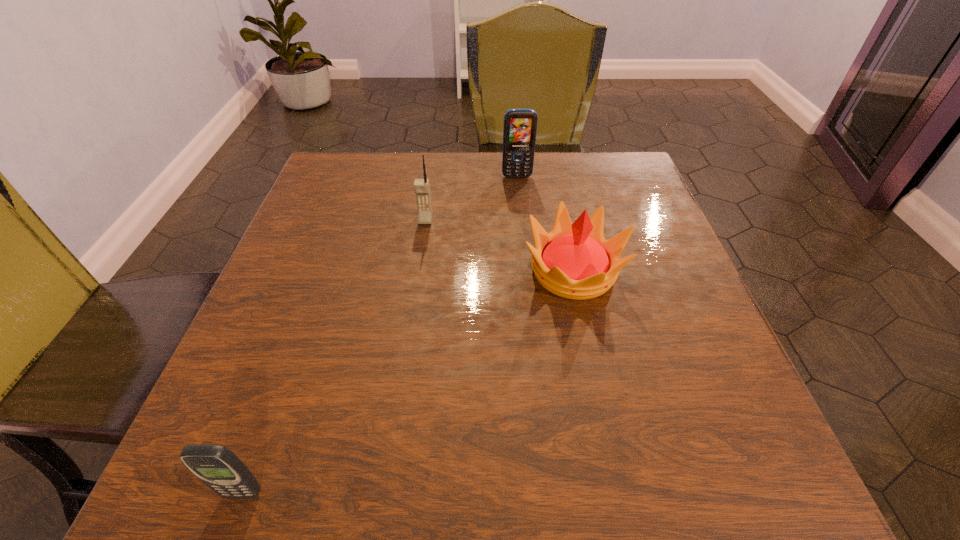
The width and height of the screenshot is (960, 540). I want to click on object present at the far edge, so click(520, 125).

You are a GUI agent. You are given a task and a screenshot of the screen. Output one action in this format:
    pyautogui.click(x=<x>, y=<y>)
    Task: Click on the object that is positioned at the near edge
    The height and width of the screenshot is (540, 960).
    Given the screenshot: What is the action you would take?
    pyautogui.click(x=220, y=469)

Find the location of `object present at the left edge`. object present at the left edge is located at coordinates (220, 469).

Identify the location of object that is at the right edge. Image resolution: width=960 pixels, height=540 pixels. (574, 261).

This screenshot has width=960, height=540. What are the coordinates of `object positioned at the near left corner` in the screenshot? It's located at (220, 469).

The width and height of the screenshot is (960, 540). In the image, there is a desktop. What are the coordinates of `vacant space at the far edge` in the screenshot? It's located at (441, 183).

This screenshot has width=960, height=540. In the image, there is a desktop. In order to click on vacant area at the near edge in this screenshot , I will do `click(335, 478)`.

This screenshot has width=960, height=540. What are the coordinates of `vacant space at the left edge of the desktop` in the screenshot? It's located at (295, 386).

I want to click on free space at the right edge of the desktop, so click(x=605, y=234).

Find the location of a particular element. The height and width of the screenshot is (540, 960). vacant area at the far left corner is located at coordinates (318, 184).